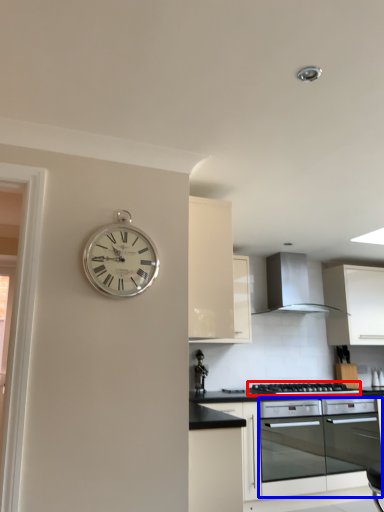
Question: Which point is closer to the camera, gas stove (highlighted by a red box) or oven (highlighted by a blue box)?

Choices:
 (A) gas stove
 (B) oven

Answer: (B)